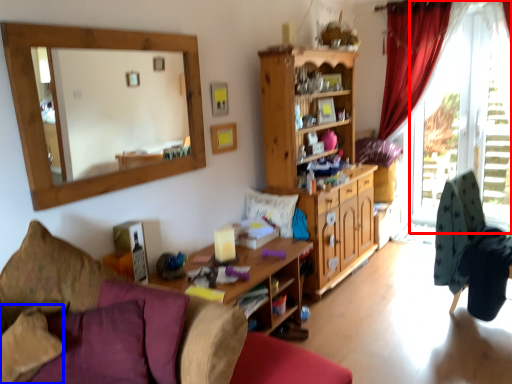
Question: Which point is further to the camera, window frame (highlighted by a red box) or pillow (highlighted by a blue box)?

Choices:
 (A) window frame
 (B) pillow

Answer: (A)